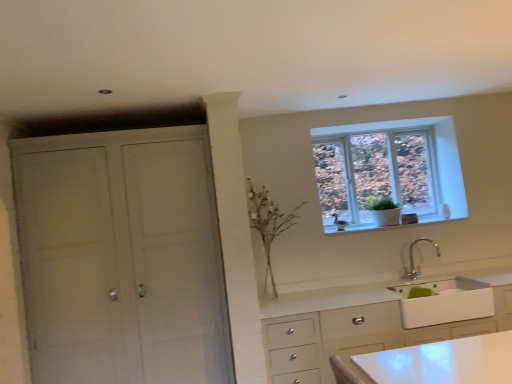
The image size is (512, 384). Describe the element at coordinates (442, 297) in the screenshot. I see `white glossy sink at lower right` at that location.

Measure the distance between point (410, 260) and camera.

The depth of point (410, 260) is 4.01 meters.

This screenshot has width=512, height=384. What do you see at coordinates (388, 171) in the screenshot?
I see `clear glass window at upper right` at bounding box center [388, 171].

This screenshot has width=512, height=384. I want to click on white matte cabinet at left, so click(122, 257).

Locate an element on the screen. Image resolution: width=512 pixels, height=384 pixels. white glossy sink at lower right is located at coordinates (442, 297).

Which is in front, point (413, 243) or point (372, 188)?

Positioned in front is point (413, 243).

From a real-world perspective, who is located higher, silver metallic faucet at lower center or clear glass window at upper right?

In real-world perspective, clear glass window at upper right is above.

Considering the sizes of objects silver metallic faucet at lower center and clear glass window at upper right in the image provided, who is smaller, silver metallic faucet at lower center or clear glass window at upper right?

silver metallic faucet at lower center.

Consider the image. Considering the sizes of objects silver metallic faucet at lower center and clear glass window at upper right in the image provided, who is wider, silver metallic faucet at lower center or clear glass window at upper right?

Wider between the two is silver metallic faucet at lower center.

Locate an element on the screen. Image resolution: width=512 pixels, height=384 pixels. sink that appears below the white ceramic window sill at upper right (from a real-world perspective) is located at coordinates (442, 297).

From the image's perspective, is white glossy sink at lower right on white ceramic window sill at upper right?

No, from the image's perspective, white glossy sink at lower right is not on top of white ceramic window sill at upper right.

From a real-world perspective, does white glossy sink at lower right sit lower than white ceramic window sill at upper right?

Yes, from a real-world perspective, white glossy sink at lower right is beneath white ceramic window sill at upper right.

How many degrees apart are the facing directions of white glossy sink at lower right and white ceramic window sill at upper right?

The angle between the facing direction of white glossy sink at lower right and the facing direction of white ceramic window sill at upper right is 2.29 degrees.

Which is in front, point (192, 376) or point (410, 276)?

Positioned in front is point (192, 376).

Between white matte cabinet at left and white glossy sink at lower right, which one is positioned in front?

white matte cabinet at left is more forward.

Consider the image. Looking at the image, does white matte cabinet at left seem bigger or smaller compared to white glossy sink at lower right?

Clearly, white matte cabinet at left is larger in size than white glossy sink at lower right.

In the scene shown: Measure the distance from white matte cabinet at left to white glossy sink at lower right.

white matte cabinet at left and white glossy sink at lower right are 6.79 feet apart from each other.

From the image's perspective, would you say clear glass window at upper right is positioned over white glossy sink at lower right?

Indeed, from the image's perspective, clear glass window at upper right is shown above white glossy sink at lower right.

In the scene shown: Is clear glass window at upper right positioned far away from white glossy sink at lower right?

clear glass window at upper right is far away from white glossy sink at lower right.

Relative to white glossy sink at lower right, is clear glass window at upper right in front or behind?

Clearly, clear glass window at upper right is behind white glossy sink at lower right.

Does clear glass window at upper right have a greater width compared to white ceramic window sill at upper right?

No.

In the image, there is a clear glass window at upper right. Where is `window sill below it (from a real-world perspective)`? This screenshot has width=512, height=384. window sill below it (from a real-world perspective) is located at coordinates (400, 224).

From a real-world perspective, is clear glass window at upper right located higher than white ceramic window sill at upper right?

Yes, from a real-world perspective, clear glass window at upper right is over white ceramic window sill at upper right

How distant is clear glass window at upper right from white ceramic window sill at upper right?

clear glass window at upper right and white ceramic window sill at upper right are 19.84 inches apart from each other.

Considering the sizes of objects white glossy sink at lower right and silver metallic faucet at lower center in the image provided, who is wider, white glossy sink at lower right or silver metallic faucet at lower center?

Wider between the two is white glossy sink at lower right.

From a real-world perspective, relative to silver metallic faucet at lower center, is white glossy sink at lower right vertically above or below?

white glossy sink at lower right is below silver metallic faucet at lower center.

Considering the points (418, 304) and (415, 279), which point is in front, point (418, 304) or point (415, 279)?

Point (418, 304)

From the image's perspective, which is below, white matte cabinet at left or clear glass window at upper right?

white matte cabinet at left.

Considering the sizes of white matte cabinet at left and clear glass window at upper right in the image, is white matte cabinet at left bigger or smaller than clear glass window at upper right?

Clearly, white matte cabinet at left is larger in size than clear glass window at upper right.

Is white matte cabinet at left facing towards clear glass window at upper right?

No, white matte cabinet at left is not facing towards clear glass window at upper right.

Is white matte cabinet at left touching clear glass window at upper right?

No.

This screenshot has width=512, height=384. Identify the location of tap below the clear glass window at upper right (from a real-world perspective). (413, 259).

Identify the location of window sill on the left of white glossy sink at lower right. (400, 224).

Looking at the image, which one is located closer to white glossy sink at lower right, white ceramic window sill at upper right or silver metallic faucet at lower center?

The object closer to white glossy sink at lower right is silver metallic faucet at lower center.

Considering their positions, is white matte cabinet at left positioned closer to silver metallic faucet at lower center than white ceramic window sill at upper right?

Based on the image, white ceramic window sill at upper right appears to be nearer to silver metallic faucet at lower center.

Based on their spatial positions, is clear glass window at upper right or white glossy sink at lower right closer to silver metallic faucet at lower center?

The object closer to silver metallic faucet at lower center is white glossy sink at lower right.

When comparing their distances from white matte cabinet at left, does white glossy sink at lower right or white ceramic window sill at upper right seem further?

The object further to white matte cabinet at left is white glossy sink at lower right.

Estimate the real-world distances between objects in this image. Which object is further from silver metallic faucet at lower center, white ceramic window sill at upper right or clear glass window at upper right?

clear glass window at upper right is positioned further to the anchor silver metallic faucet at lower center.

When comparing their distances from silver metallic faucet at lower center, does white matte cabinet at left or clear glass window at upper right seem closer?

clear glass window at upper right is closer to silver metallic faucet at lower center.

Which object lies further to the anchor point clear glass window at upper right, white ceramic window sill at upper right or white glossy sink at lower right?

white glossy sink at lower right is positioned further to the anchor clear glass window at upper right.

When comparing their distances from white matte cabinet at left, does silver metallic faucet at lower center or clear glass window at upper right seem closer?

clear glass window at upper right.

Where is `window between white matte cabinet at left and white glossy sink at lower right`? window between white matte cabinet at left and white glossy sink at lower right is located at coordinates (388, 171).

The image size is (512, 384). I want to click on window between white matte cabinet at left and silver metallic faucet at lower center, so click(x=388, y=171).

Identify the location of window sill situated between white matte cabinet at left and white glossy sink at lower right from left to right. Image resolution: width=512 pixels, height=384 pixels. (400, 224).

Locate an element on the screen. window between white matte cabinet at left and white ceramic window sill at upper right from left to right is located at coordinates (388, 171).